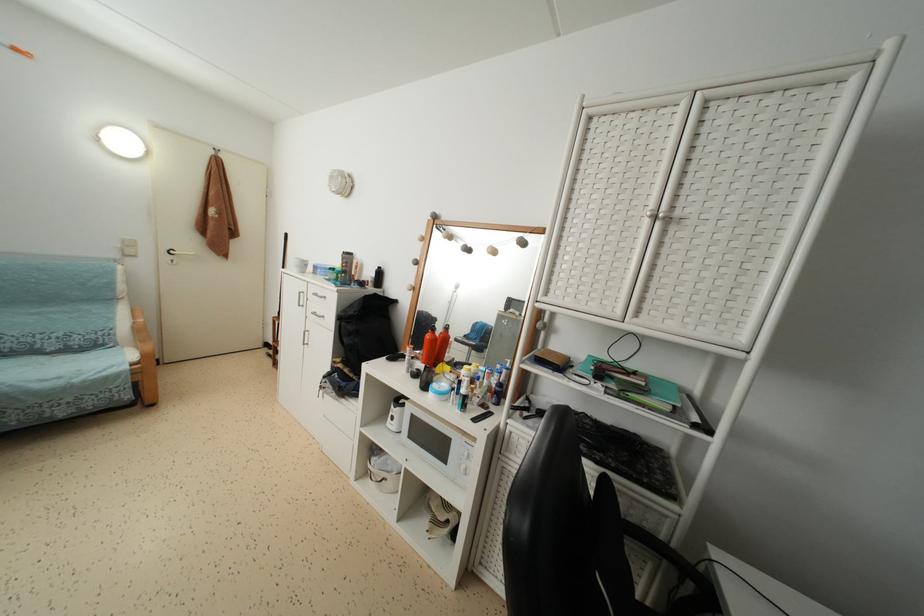
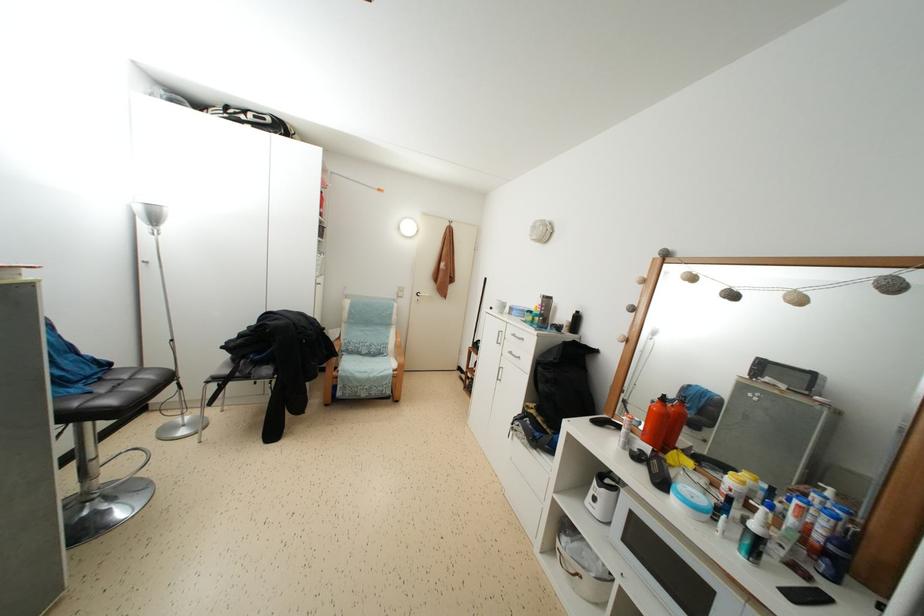
Question: How did the camera likely rotate?

Choices:
 (A) Left
 (B) Right
 (C) Up
 (D) Down

Answer: (A)